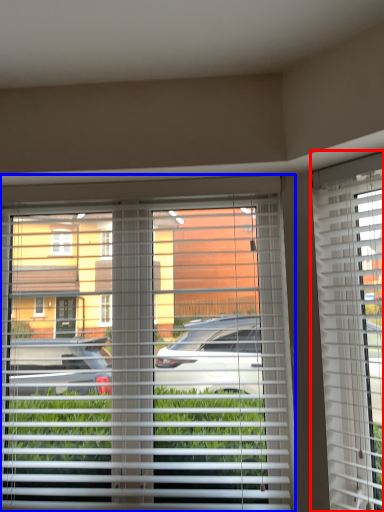
Question: Which point is further to the camera, window blind (highlighted by a red box) or window blind (highlighted by a blue box)?

Choices:
 (A) window blind
 (B) window blind

Answer: (B)